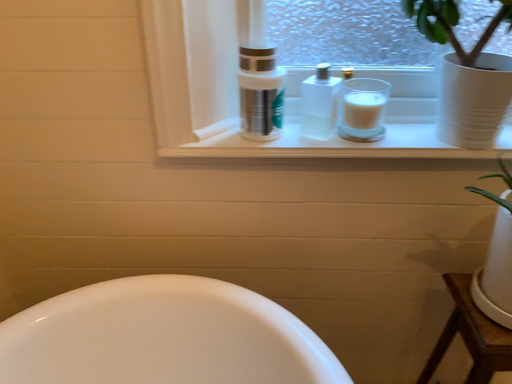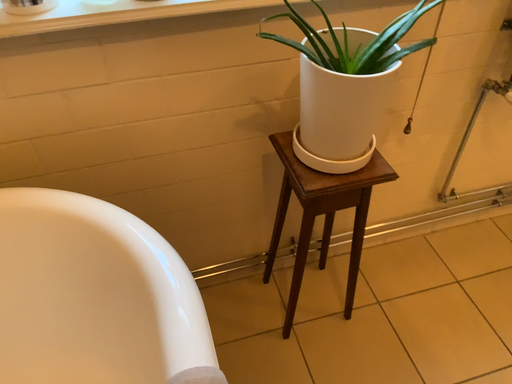
Question: Which way did the camera rotate in the video?

Choices:
 (A) rotated downward
 (B) rotated upward

Answer: (A)